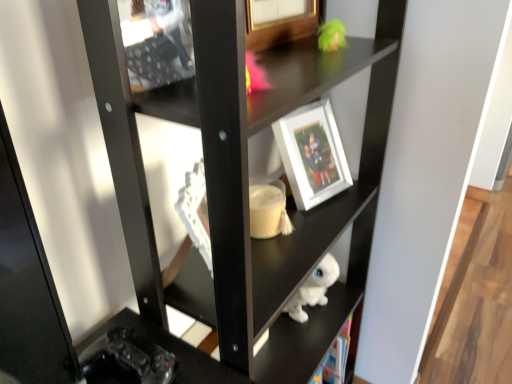
Question: Considering the positions of white matte picture frame at center and white glossy statue at lower center in the image, is white matte picture frame at center wider or thinner than white glossy statue at lower center?

Choices:
 (A) thin
 (B) wide

Answer: (A)

Question: From their relative heights in the image, would you say white matte picture frame at center is taller or shorter than white glossy statue at lower center?

Choices:
 (A) short
 (B) tall

Answer: (A)

Question: Is white matte picture frame at center bigger or smaller than white glossy statue at lower center?

Choices:
 (A) big
 (B) small

Answer: (B)

Question: In terms of height, does white glossy statue at lower center look taller or shorter compared to white matte picture frame at center?

Choices:
 (A) short
 (B) tall

Answer: (B)

Question: Would you say white glossy statue at lower center is to the left or to the right of white matte picture frame at center in the picture?

Choices:
 (A) right
 (B) left

Answer: (B)

Question: From a real-world perspective, is white glossy statue at lower center above or below white matte picture frame at center?

Choices:
 (A) above
 (B) below

Answer: (B)

Question: Is white glossy statue at lower center inside the boundaries of white matte picture frame at center, or outside?

Choices:
 (A) outside
 (B) inside

Answer: (A)